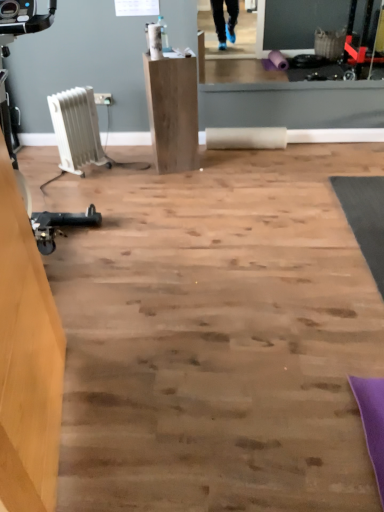
Locate an element on the screen. This screenshot has height=512, width=384. vacant region to the right of white plastic heater at left is located at coordinates (230, 213).